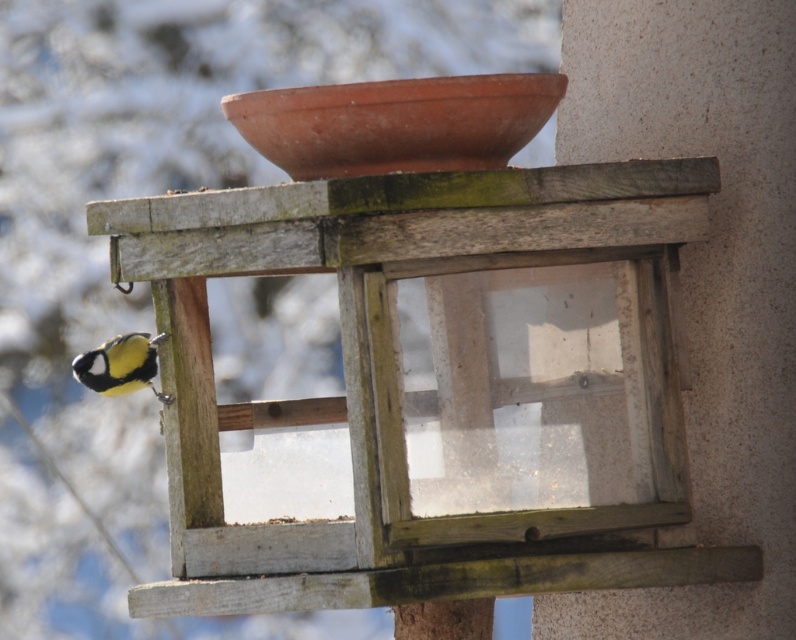
You are a birdwatcher observing the wooden bird feeder at left and the yellow matte bird at lower left. From your perspective, which object is located to the right?

The wooden bird feeder at left is positioned on the right side of yellow matte bird at lower left, so the wooden bird feeder at left is to the right of the yellow matte bird at lower left.

You are a birdwatcher trying to capture a photo of the yellow matte bird at lower left. The wooden bird feeder at left is blocking your view. Can you move the bird feeder to the right to get a better shot?

The wooden bird feeder at left is much taller than the yellow matte bird at lower left, so moving it might not be necessary as the bird is smaller and the feeder is taller, but physically moving the feeder could disturb the bird.

You are a birdwatcher trying to capture a photo of the yellow matte bird at lower left. The wooden bird feeder at left is in the way. Can you move the feeder to the right to get a clear shot of the bird?

The wooden bird feeder at left is wider than the yellow matte bird at lower left, so moving it to the right might block the bird more since the feeder is larger in width.